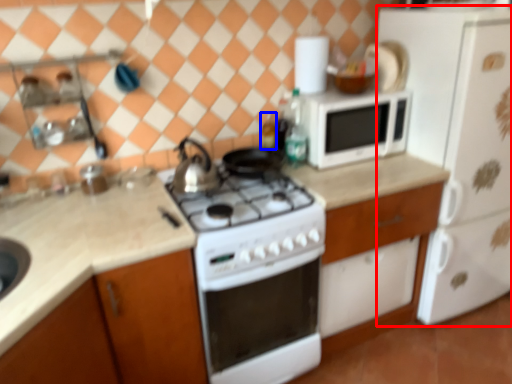
Question: Which of the following is the farthest to the observer, refrigerator (highlighted by a red box) or bottle (highlighted by a blue box)?

Choices:
 (A) refrigerator
 (B) bottle

Answer: (B)